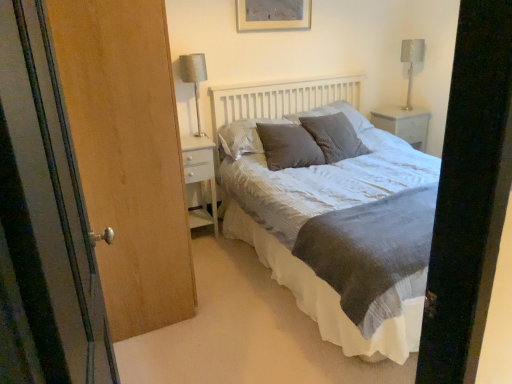
You are a GUI agent. You are given a task and a screenshot of the screen. Output one action in this format:
    pyautogui.click(x=<x>, y=<y>)
    Task: Click on the vacant region below white wood nightstand at left, the first nightstand ordered from the bottom (from a real-world perspective)
    The width and height of the screenshot is (512, 384).
    Given the screenshot: What is the action you would take?
    pyautogui.click(x=201, y=238)